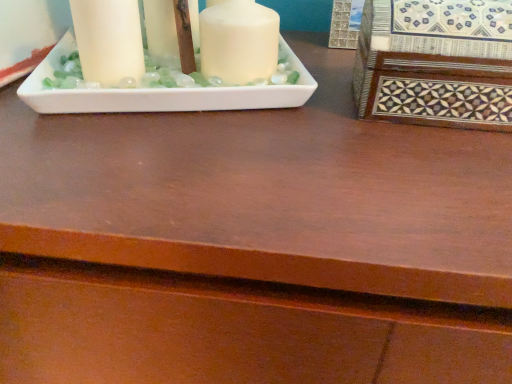
Image resolution: width=512 pixels, height=384 pixels. What do you see at coordinates (436, 63) in the screenshot?
I see `inlaid wood box at right` at bounding box center [436, 63].

Where is `inlaid wood box at right`? Image resolution: width=512 pixels, height=384 pixels. inlaid wood box at right is located at coordinates pos(436,63).

You are a GUI agent. You are given a task and a screenshot of the screen. Output one action in this format:
    pyautogui.click(x=<x>, y=<y>)
    Task: Click on the inlaid wood box at right
    This screenshot has width=512, height=384.
    Given the screenshot: What is the action you would take?
    pyautogui.click(x=436, y=63)